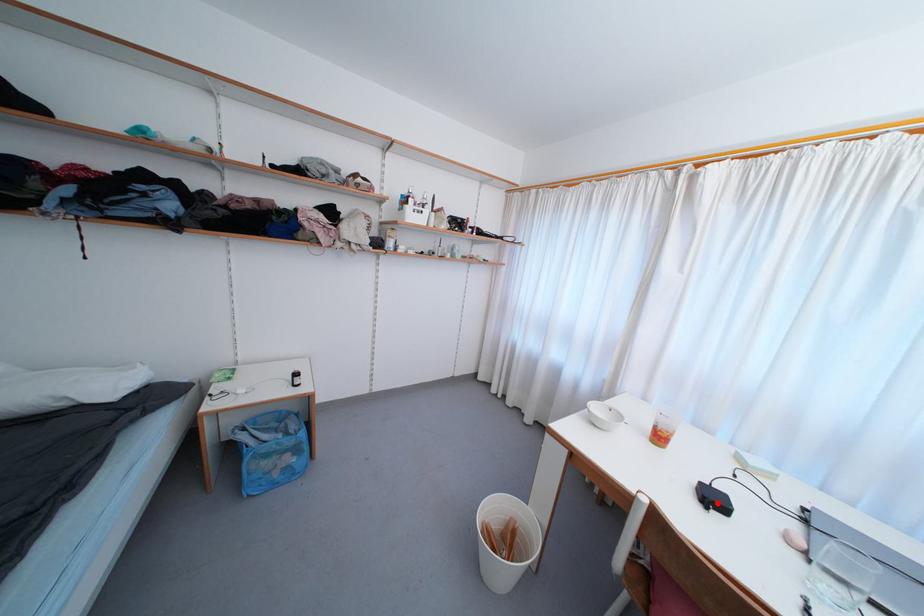
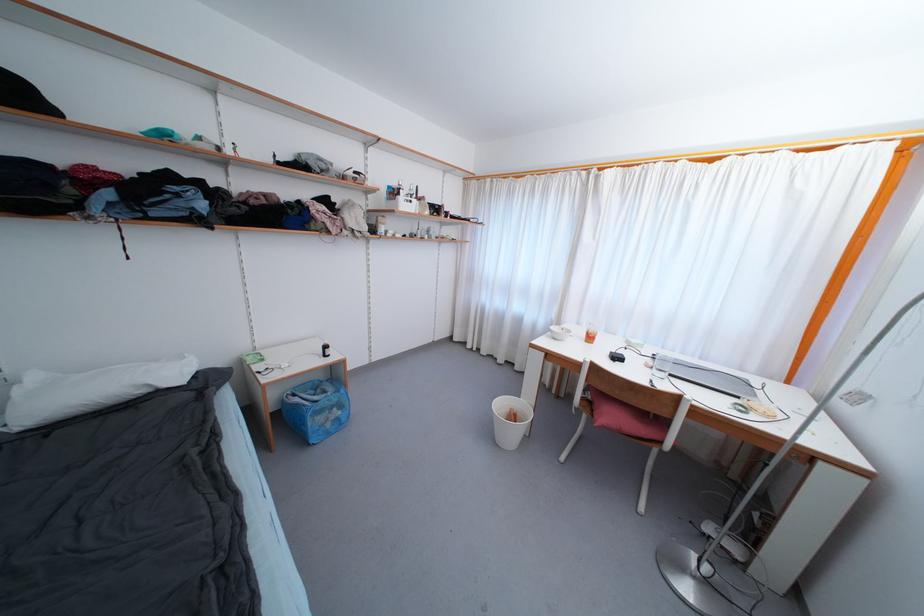
Where in the second image is the point corresponding to the highlighted location from the first image?

(621, 361)